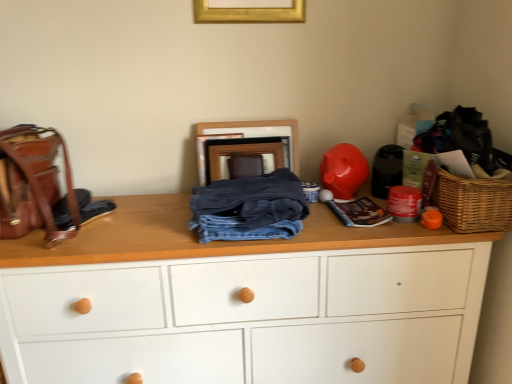
Question: From a real-world perspective, is leather backpack at left located beneath shiny plastic piggy bank at right?

Choices:
 (A) no
 (B) yes

Answer: (A)

Question: Is leather backpack at left next to shiny plastic piggy bank at right and touching it?

Choices:
 (A) yes
 (B) no

Answer: (B)

Question: Is leather backpack at left facing towards shiny plastic piggy bank at right?

Choices:
 (A) no
 (B) yes

Answer: (A)

Question: Is leather backpack at left closer to the viewer compared to shiny plastic piggy bank at right?

Choices:
 (A) no
 (B) yes

Answer: (B)

Question: Considering the relative sizes of leather backpack at left and shiny plastic piggy bank at right in the image provided, is leather backpack at left shorter than shiny plastic piggy bank at right?

Choices:
 (A) no
 (B) yes

Answer: (A)

Question: From a real-world perspective, is gold metallic picture frame at upper center, positioned as the 2th picture frame in bottom-to-top order, above or below woven brown picnic basket at right?

Choices:
 (A) above
 (B) below

Answer: (A)

Question: Considering the relative positions of gold metallic picture frame at upper center, acting as the 1th picture frame starting from the top, and woven brown picnic basket at right in the image provided, is gold metallic picture frame at upper center, acting as the 1th picture frame starting from the top, to the left or to the right of woven brown picnic basket at right?

Choices:
 (A) left
 (B) right

Answer: (A)

Question: From the image's perspective, is gold metallic picture frame at upper center, marked as the second picture frame in a back-to-front arrangement, above or below woven brown picnic basket at right?

Choices:
 (A) above
 (B) below

Answer: (A)

Question: Considering the positions of gold metallic picture frame at upper center, marked as the second picture frame in a back-to-front arrangement, and woven brown picnic basket at right in the image, is gold metallic picture frame at upper center, marked as the second picture frame in a back-to-front arrangement, bigger or smaller than woven brown picnic basket at right?

Choices:
 (A) small
 (B) big

Answer: (A)

Question: Is shiny plastic piggy bank at right to the left or to the right of gold metallic picture frame at upper center, positioned as the 2th picture frame in bottom-to-top order, in the image?

Choices:
 (A) left
 (B) right

Answer: (B)

Question: Relative to gold metallic picture frame at upper center, which appears as the first picture frame when viewed from the front, is shiny plastic piggy bank at right in front or behind?

Choices:
 (A) front
 (B) behind

Answer: (B)

Question: Is shiny plastic piggy bank at right taller or shorter than gold metallic picture frame at upper center, marked as the second picture frame in a back-to-front arrangement?

Choices:
 (A) short
 (B) tall

Answer: (A)

Question: Is shiny plastic piggy bank at right bigger or smaller than gold metallic picture frame at upper center, which appears as the first picture frame when viewed from the front?

Choices:
 (A) big
 (B) small

Answer: (B)

Question: From a real-world perspective, is gold metallic picture frame at upper center, which appears as the first picture frame when viewed from the front, physically located above or below wooden picture frame at center, which is the 1th picture frame in back-to-front order?

Choices:
 (A) above
 (B) below

Answer: (A)

Question: Is point (201, 6) closer or farther from the camera than point (292, 147)?

Choices:
 (A) farther
 (B) closer

Answer: (B)